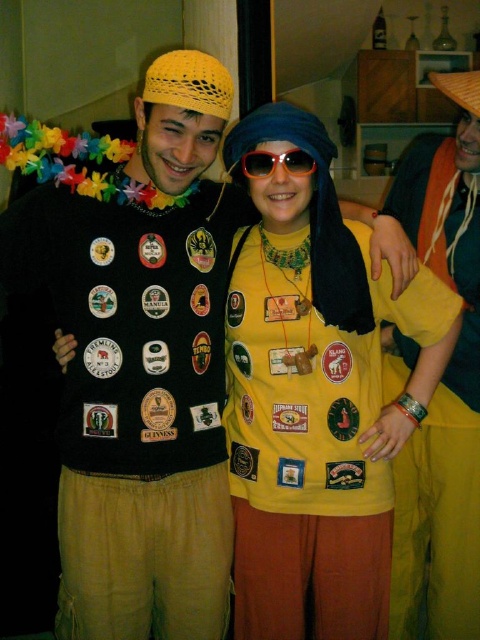
Question: Which object is positioned closest to the yellow fabric pants at right?

Choices:
 (A) yellow knitted hat at upper center
 (B) black plastic sunglasses at center
 (C) yellow matte shirt at center

Answer: (C)

Question: Does yellow fabric pants at right have a smaller size compared to black plastic sunglasses at center?

Choices:
 (A) yes
 (B) no

Answer: (B)

Question: Which object is farther from the camera taking this photo?

Choices:
 (A) yellow matte shirt at center
 (B) yellow fabric pants at right
 (C) wooden at upper right

Answer: (B)

Question: Which object is closer to the camera taking this photo?

Choices:
 (A) wooden at upper right
 (B) yellow matte shirt at center
 (C) yellow knitted hat at upper center
 (D) black plastic sunglasses at center

Answer: (C)

Question: Does yellow matte shirt at center have a smaller size compared to black plastic sunglasses at center?

Choices:
 (A) no
 (B) yes

Answer: (A)

Question: Is black plastic sunglasses at center wider than wooden at upper right?

Choices:
 (A) yes
 (B) no

Answer: (A)